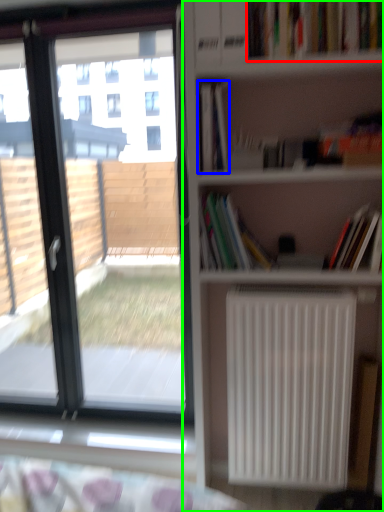
Question: Estimate the real-world distances between objects in this image. Which object is closer to book (highlighted by a red box), book (highlighted by a blue box) or bookcase (highlighted by a green box)?

Choices:
 (A) book
 (B) bookcase

Answer: (A)